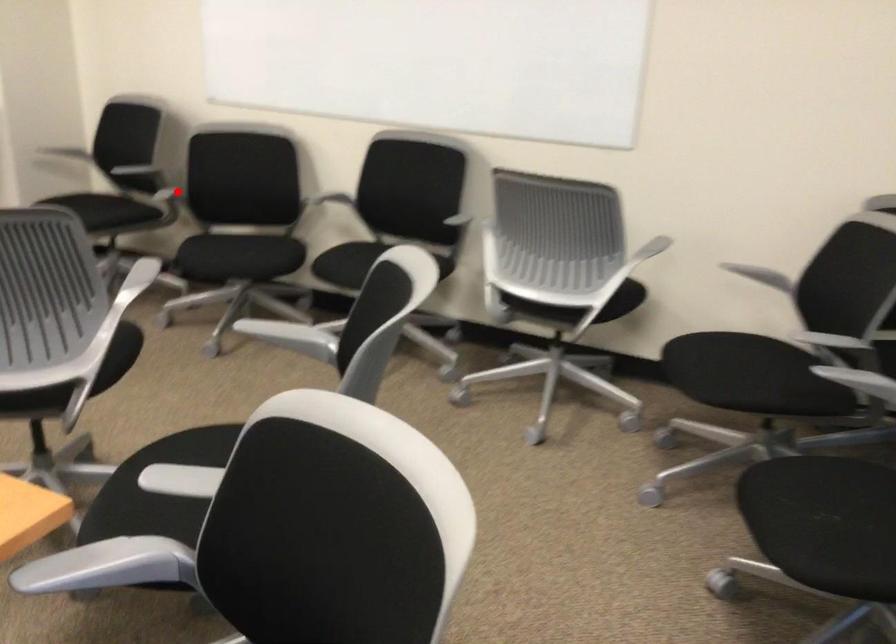
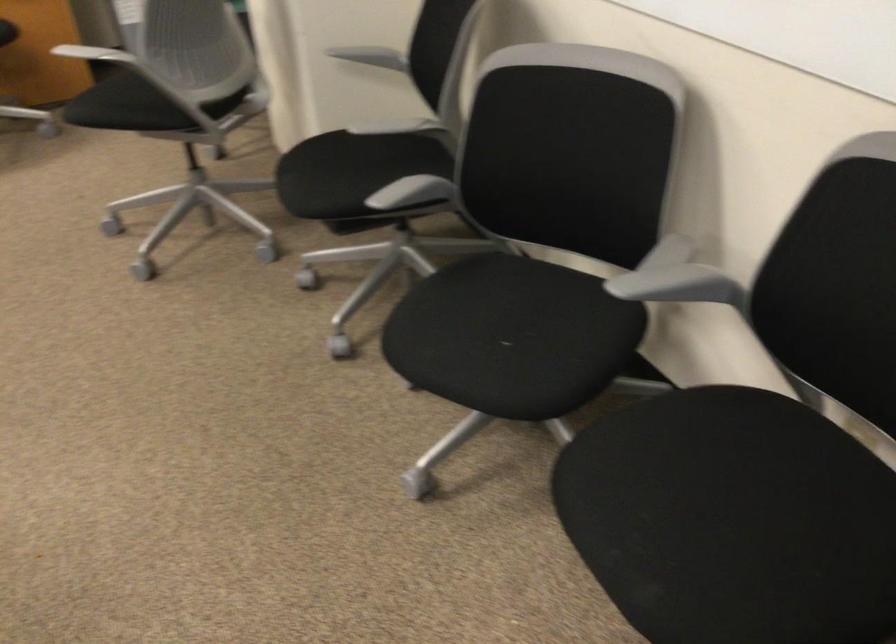
Question: I am providing you with two images of the same scene from different viewpoints. Given a red point in image1, look at the same physical point in image2. Is it:

Choices:
 (A) Closer to the viewpoint
 (B) Farther from the viewpoint

Answer: (A)